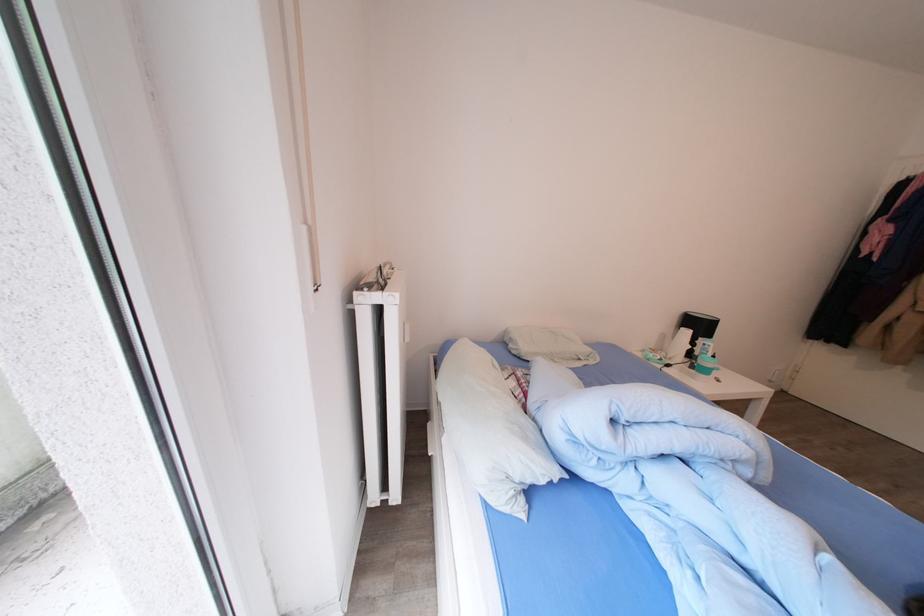
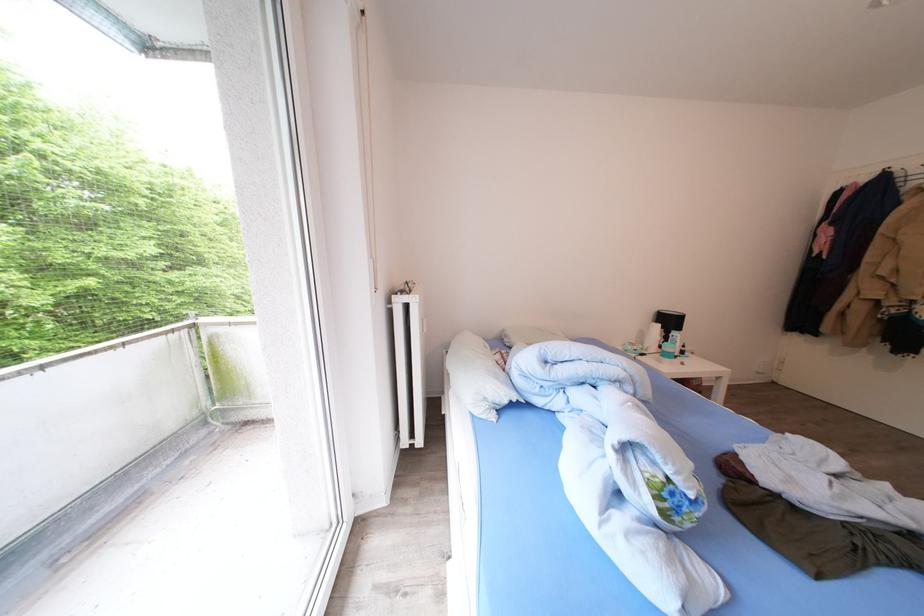
In the second image, find the point that corresponds to pixel 535 444 in the first image.

(505, 383)